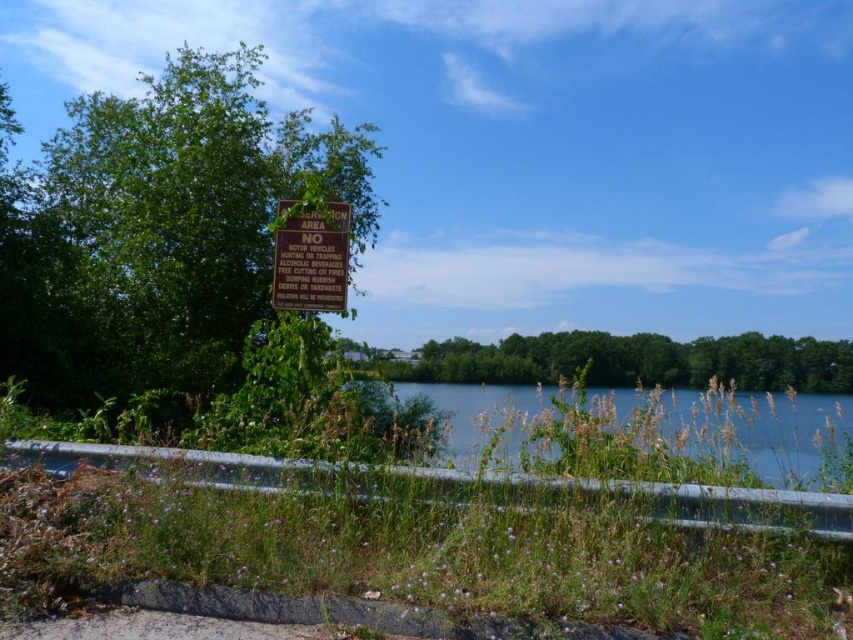
Is green leafy tree at upper left shorter than green leafy trees at center?

Yes.

Can you confirm if green leafy tree at upper left is taller than green leafy trees at center?

No, green leafy tree at upper left is not taller than green leafy trees at center.

At what (x,y) coordinates should I click in order to perform the action: click on green leafy tree at upper left. Please return your answer as a coordinate pair (x, y). This screenshot has width=853, height=640. Looking at the image, I should click on (160, 230).

The image size is (853, 640). What are the coordinates of `green leafy tree at upper left` in the screenshot? It's located at (160, 230).

Is clear water at center below brown wooden sign at upper center?

Yes, clear water at center is below brown wooden sign at upper center.

Can you confirm if clear water at center is wider than brown wooden sign at upper center?

Yes.

You are a GUI agent. You are given a task and a screenshot of the screen. Output one action in this format:
    pyautogui.click(x=<x>, y=<y>)
    Task: Click on the clear water at center
    
    Given the screenshot: What is the action you would take?
    pos(746,428)

Can you confirm if green leafy trees at center is thinner than brown wooden sign at upper center?

In fact, green leafy trees at center might be wider than brown wooden sign at upper center.

Is green leafy trees at center to the right of brown wooden sign at upper center from the viewer's perspective?

Correct, you'll find green leafy trees at center to the right of brown wooden sign at upper center.

Which is in front, point (608, 380) or point (291, 243)?

Positioned in front is point (291, 243).

Locate an element on the screen. The width and height of the screenshot is (853, 640). green leafy trees at center is located at coordinates (633, 362).